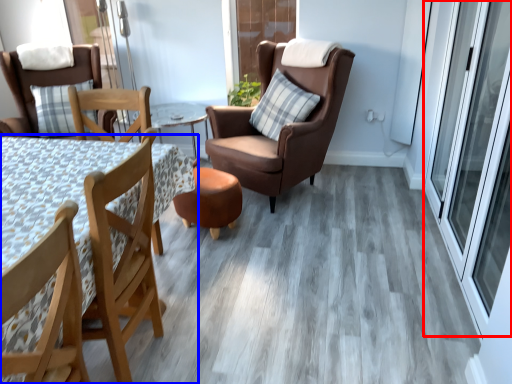
Question: Which object appears closest to the camera in this image, screen door (highlighted by a red box) or table (highlighted by a blue box)?

Choices:
 (A) screen door
 (B) table

Answer: (B)